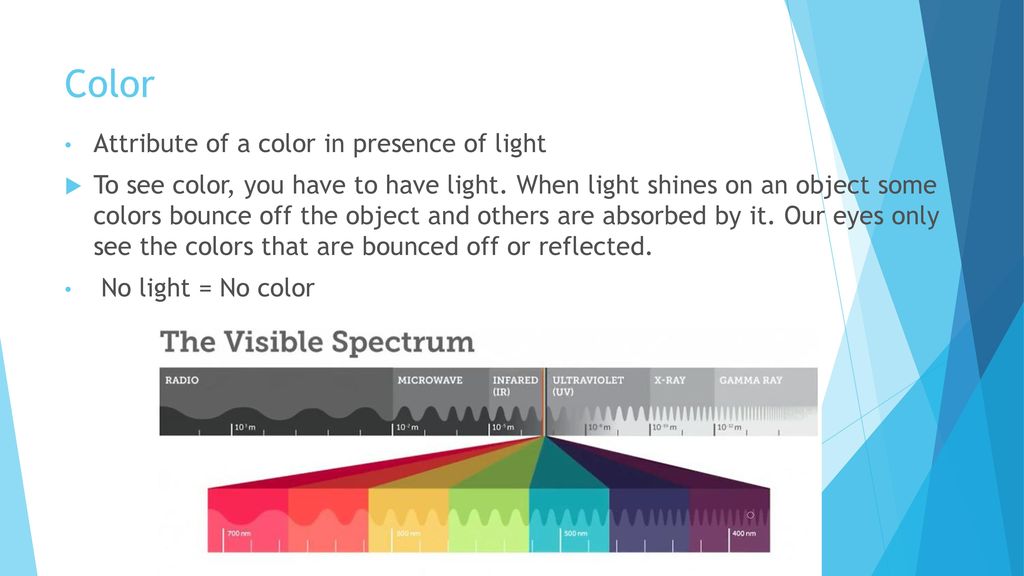
Where is `microwave section of bar`? microwave section of bar is located at coordinates (430, 396).